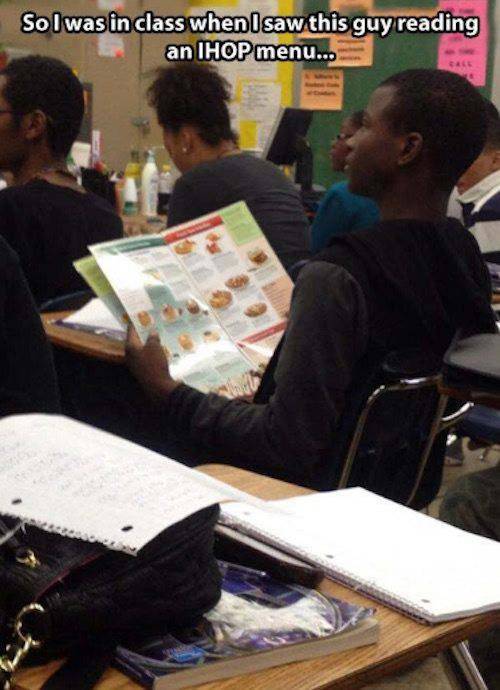
Find the location of a particular element. Image resolution: width=500 pixels, height=690 pixels. computer monitor is located at coordinates (291, 130).